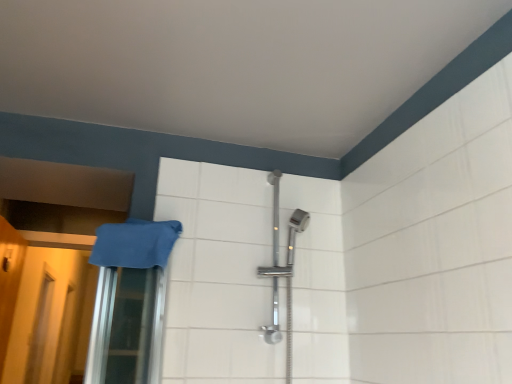
Question: Is yellow matte door at left directly adjacent to translucent plastic screen door at lower left, acting as the 2th screen door starting from the right?

Choices:
 (A) no
 (B) yes

Answer: (A)

Question: Is yellow matte door at left wider than translucent plastic screen door at lower left, the 1th screen door viewed from the back?

Choices:
 (A) no
 (B) yes

Answer: (B)

Question: Can you confirm if yellow matte door at left is bigger than translucent plastic screen door at lower left, which is counted as the second screen door, starting from the front?

Choices:
 (A) yes
 (B) no

Answer: (B)

Question: Does yellow matte door at left lie in front of translucent plastic screen door at lower left, which is the 1th screen door from left to right?

Choices:
 (A) no
 (B) yes

Answer: (B)

Question: Is yellow matte door at left further to camera compared to translucent plastic screen door at lower left, acting as the 2th screen door starting from the right?

Choices:
 (A) no
 (B) yes

Answer: (A)

Question: Considering the positions of yellow matte door at left and blue fabric towel at left in the image, is yellow matte door at left taller or shorter than blue fabric towel at left?

Choices:
 (A) short
 (B) tall

Answer: (B)

Question: Is yellow matte door at left to the left or to the right of blue fabric towel at left in the image?

Choices:
 (A) left
 (B) right

Answer: (A)

Question: Considering the positions of point pos(13,304) and point pos(125,221), is point pos(13,304) closer or farther from the camera than point pos(125,221)?

Choices:
 (A) farther
 (B) closer

Answer: (A)

Question: In the image, is yellow matte door at left positioned in front of or behind blue fabric towel at left?

Choices:
 (A) front
 (B) behind

Answer: (B)

Question: In terms of size, does translucent plastic screen door at lower left, which is the 1th screen door from left to right, appear bigger or smaller than translucent plastic screen door at lower left, the 1th screen door when ordered from front to back?

Choices:
 (A) small
 (B) big

Answer: (B)

Question: Is translucent plastic screen door at lower left, which is counted as the second screen door, starting from the front, in front of or behind translucent plastic screen door at lower left, the 1th screen door when ordered from front to back, in the image?

Choices:
 (A) behind
 (B) front

Answer: (A)

Question: From a real-world perspective, is translucent plastic screen door at lower left, acting as the 2th screen door starting from the right, positioned above or below translucent plastic screen door at lower left, the first screen door when ordered from right to left?

Choices:
 (A) above
 (B) below

Answer: (B)

Question: Is translucent plastic screen door at lower left, which is counted as the second screen door, starting from the front, taller or shorter than translucent plastic screen door at lower left, the 1th screen door when ordered from front to back?

Choices:
 (A) tall
 (B) short

Answer: (A)

Question: Considering the positions of translucent plastic screen door at lower left, marked as the 2th screen door in a back-to-front arrangement, and translucent plastic screen door at lower left, which is the 1th screen door from left to right, in the image, is translucent plastic screen door at lower left, marked as the 2th screen door in a back-to-front arrangement, taller or shorter than translucent plastic screen door at lower left, which is the 1th screen door from left to right,?

Choices:
 (A) tall
 (B) short

Answer: (B)

Question: Is point (40, 354) positioned closer to the camera than point (38, 380)?

Choices:
 (A) farther
 (B) closer

Answer: (A)